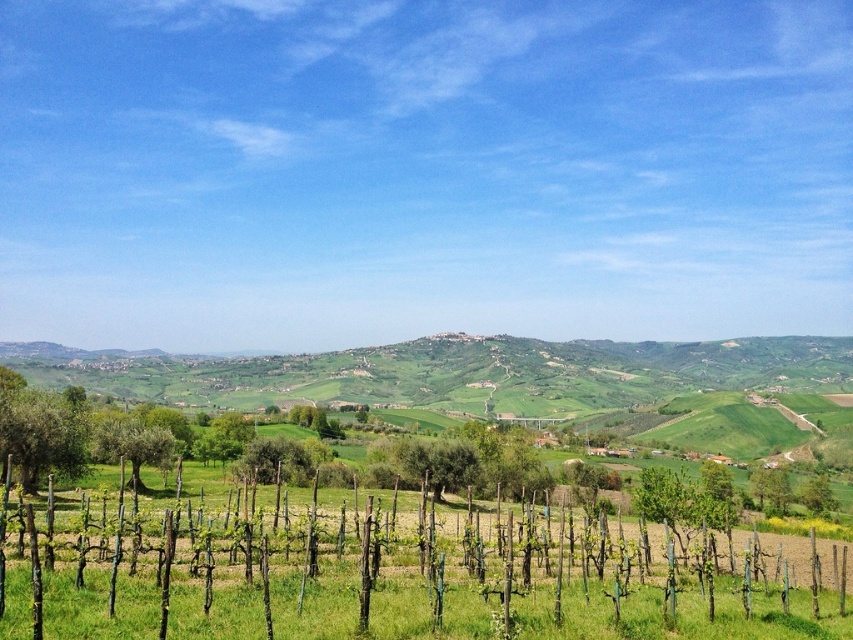
Is green leafy tree at lower left behind green rough bark tree at left?

No, green leafy tree at lower left is in front of green rough bark tree at left.

Is point (35, 429) farther from camera compared to point (122, 449)?

No.

Locate an element on the screen. green leafy tree at lower left is located at coordinates (42, 435).